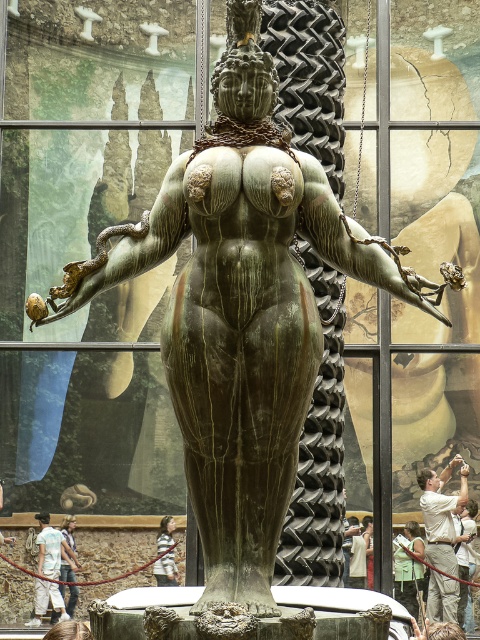
You are an interior designer planning to place a new sculpture in a room. You have two items in the scene, the light blue denim jeans at lower left and the light brown wooden stick at lower center. Which item should you avoid placing near the sculpture to ensure there is enough space for visitors to move around comfortably?

The light blue denim jeans at lower left is smaller than the light brown wooden stick at lower center. To ensure enough space for visitors, you should avoid placing the light brown wooden stick at lower center near the sculpture since it is larger and would take up more space.

You are an art conservator examining the sculpture from the front. You notice two points on the sculpture marked at coordinates point (437, 497) and point (48, 538). Which point is nearer to your current position?

Point (437, 497) is closer to the viewer than point (48, 538).

You are a photographer standing at the camera position. You want to take a photo of the sculpture while holding a light brown wooden stick at lower center in your hand. Can you hold the stick close to the camera to frame the sculpture in the shot?

The light brown wooden stick at lower center and camera are 99.87 meters apart from each other. Since the distance between them is over 99 meters, you cannot hold the stick close to the camera to frame the sculpture in the shot.